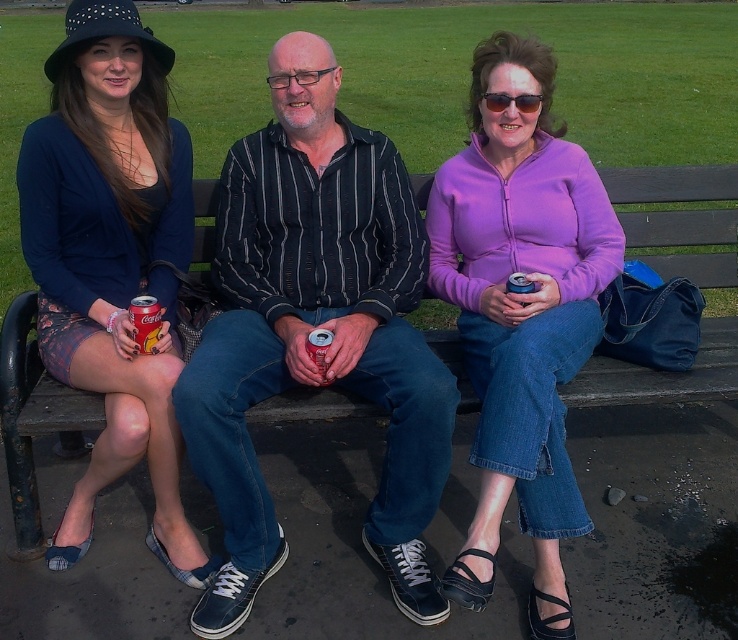
Question: Among these objects, which one is nearest to the camera?

Choices:
 (A) matte red can at left
 (B) striped cotton shirt at center
 (C) purple fleece jacket at center

Answer: (C)

Question: In this image, where is purple fleece jacket at center located relative to matte black hat at upper left?

Choices:
 (A) right
 (B) left

Answer: (A)

Question: Does matte red can at left appear under sunglasses at center?

Choices:
 (A) yes
 (B) no

Answer: (A)

Question: Based on their relative distances, which object is farther from the striped cotton shirt at center?

Choices:
 (A) matte red can at left
 (B) sunglasses at center

Answer: (B)

Question: Which object is positioned closest to the purple fleece jacket at center?

Choices:
 (A) sunglasses at center
 (B) striped cotton shirt at center

Answer: (B)

Question: Is striped cotton shirt at center bigger than sunglasses at center?

Choices:
 (A) yes
 (B) no

Answer: (A)